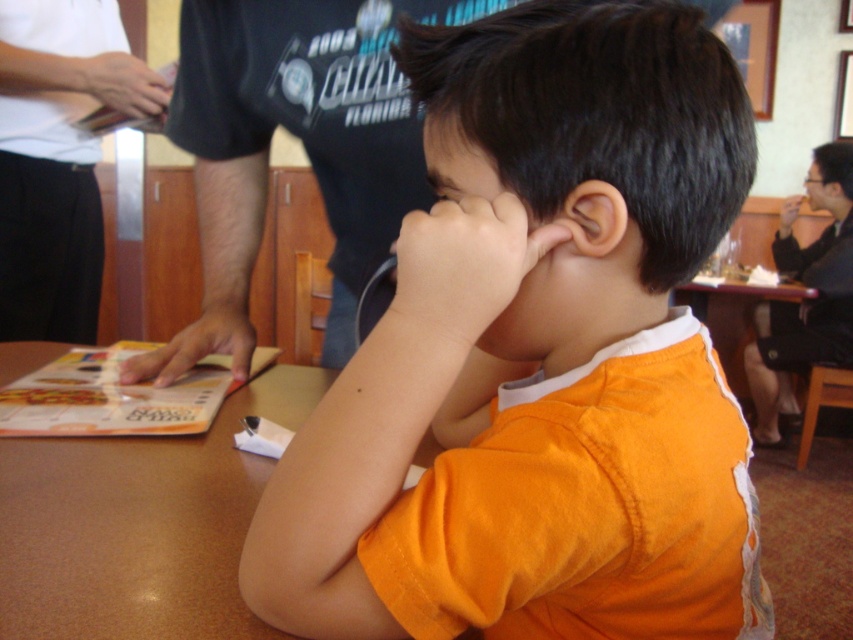
Question: Which of the following is the farthest from the observer?

Choices:
 (A) orange cotton shirt at center
 (B) white fabric shirt at left
 (C) black glossy hair at upper right

Answer: (C)

Question: Considering the real-world distances, which object is farthest from the black cotton shirt at upper center?

Choices:
 (A) white fabric shirt at left
 (B) matte black hand at upper left
 (C) matte paper menu at lower left
 (D) matte white hand at upper right

Answer: (D)

Question: Does white fabric shirt at left appear under matte white hand at upper right?

Choices:
 (A) no
 (B) yes

Answer: (B)

Question: Does orange cotton shirt at center appear over black cotton shirt at upper center?

Choices:
 (A) yes
 (B) no

Answer: (B)

Question: Based on their relative distances, which object is nearer to the matte paper menu at lower left?

Choices:
 (A) brown laminate table at lower left
 (B) matte black hand at upper left
 (C) orange smooth skin at ear

Answer: (A)

Question: Does orange cotton shirt at center have a smaller size compared to matte black hand at upper left?

Choices:
 (A) yes
 (B) no

Answer: (B)